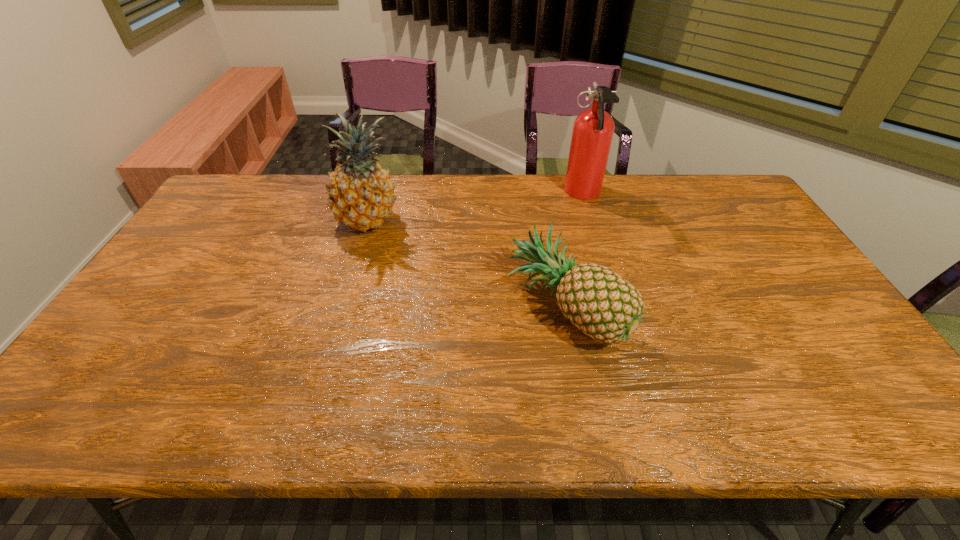
At what (x,y) coordinates should I click in order to perform the action: click on fire extinguisher. Please return your answer as a coordinate pair (x, y). The height and width of the screenshot is (540, 960). Looking at the image, I should click on (593, 129).

You are a GUI agent. You are given a task and a screenshot of the screen. Output one action in this format:
    pyautogui.click(x=<x>, y=<y>)
    Task: Click on the leftmost object
    
    Given the screenshot: What is the action you would take?
    pyautogui.click(x=361, y=194)

Locate an element on the screen. The image size is (960, 540). the farther pineapple is located at coordinates tap(361, 194).

Where is `the right pineapple`? The width and height of the screenshot is (960, 540). the right pineapple is located at coordinates (603, 305).

At what (x,y) coordinates should I click in order to perform the action: click on the nearer pineapple. Please return your answer as a coordinate pair (x, y). Looking at the image, I should click on (603, 305).

This screenshot has height=540, width=960. Identify the location of free space located 0.090m on the front of the fire extinguisher. (593, 227).

Locate an element on the screen. This screenshot has height=540, width=960. vacant area situated 0.210m on the front of the leftmost object is located at coordinates (346, 292).

Image resolution: width=960 pixels, height=540 pixels. Find the location of `vacant space located 0.110m on the back of the nearer pineapple`. vacant space located 0.110m on the back of the nearer pineapple is located at coordinates (552, 240).

This screenshot has width=960, height=540. What are the coordinates of `fire extinguisher located at the far edge` in the screenshot? It's located at (593, 129).

Where is `pineapple located in the far edge section of the desktop`? pineapple located in the far edge section of the desktop is located at coordinates (361, 194).